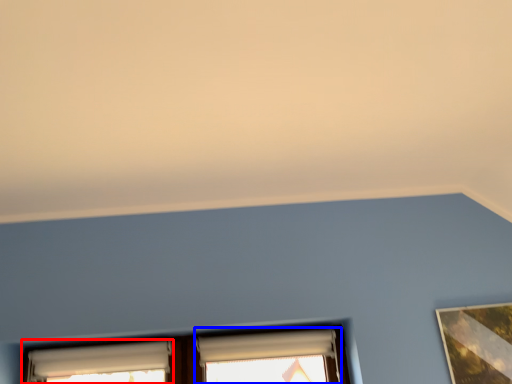
Question: Which object is further to the camera taking this photo, window (highlighted by a red box) or window (highlighted by a blue box)?

Choices:
 (A) window
 (B) window

Answer: (B)